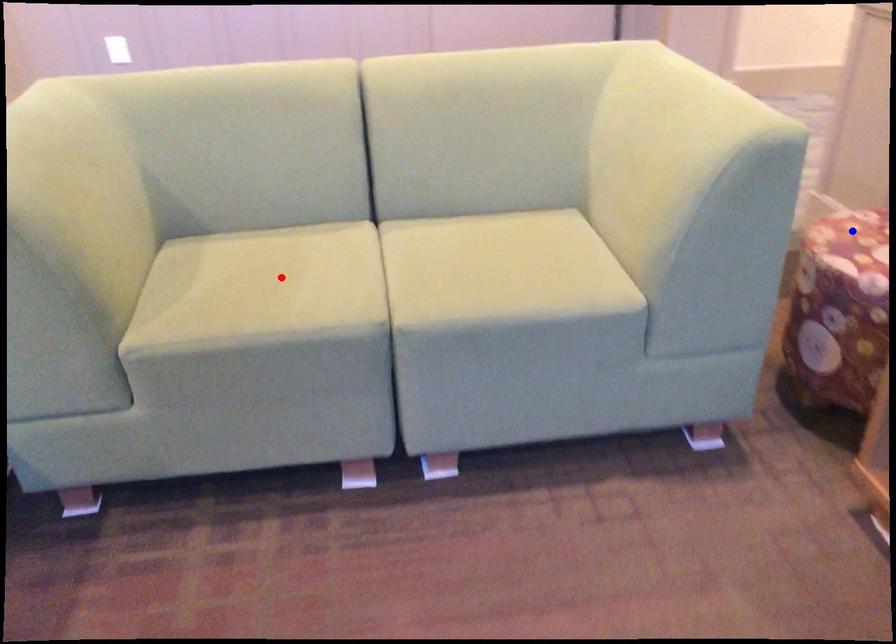
Question: Which of the two points in the image is closer to the camera?

Choices:
 (A) Blue point is closer.
 (B) Red point is closer.

Answer: (B)